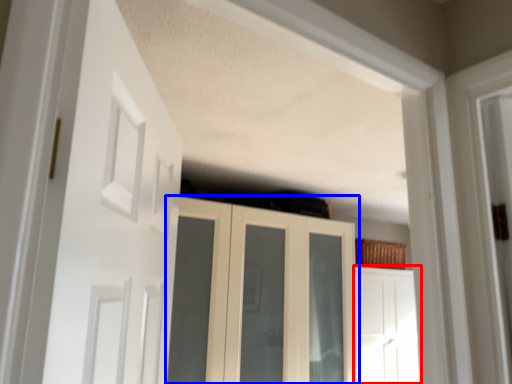
Question: Which object appears closest to the camera in this image, door (highlighted by a red box) or cupboard (highlighted by a blue box)?

Choices:
 (A) door
 (B) cupboard

Answer: (B)